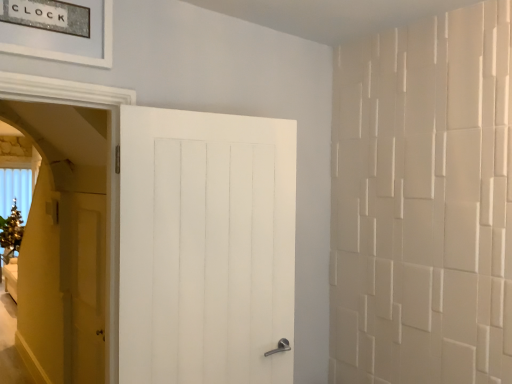
Locate an element on the screen. This screenshot has height=384, width=512. white wooden door at center, the first door viewed from the right is located at coordinates (205, 246).

Describe the element at coordinates (205, 246) in the screenshot. The height and width of the screenshot is (384, 512). I see `white wooden door at center, the 1th door in the front-to-back sequence` at that location.

This screenshot has height=384, width=512. Describe the element at coordinates (84, 285) in the screenshot. I see `matte wood door at left, which is the first door from left to right` at that location.

At what (x,y) coordinates should I click in order to perform the action: click on matte wood door at left, which appears as the 2th door when viewed from the front. Please return your answer as a coordinate pair (x, y). This screenshot has width=512, height=384. Looking at the image, I should click on (84, 285).

Locate an element on the screen. white wooden door at center, the second door viewed from the left is located at coordinates (205, 246).

Which object is positioned more to the left, white wooden door at center, which is counted as the 2th door, starting from the back, or matte wood door at left, placed as the 2th door when sorted from right to left?

Positioned to the left is matte wood door at left, placed as the 2th door when sorted from right to left.

Which is behind, white wooden door at center, the 1th door in the front-to-back sequence, or matte wood door at left, the first door positioned from the back?

matte wood door at left, the first door positioned from the back, is further from the camera.

Does point (283, 367) come closer to viewer compared to point (97, 289)?

That is True.

From the image's perspective, which one is positioned lower, white wooden door at center, the 1th door in the front-to-back sequence, or matte wood door at left, which is the first door from left to right?

From the image's view, matte wood door at left, which is the first door from left to right, is below.

From a real-world perspective, between white wooden door at center, the 1th door in the front-to-back sequence, and matte wood door at left, placed as the 2th door when sorted from right to left, who is vertically lower?

matte wood door at left, placed as the 2th door when sorted from right to left, is physically lower.

Is white wooden door at center, the 1th door in the front-to-back sequence, thinner than matte wood door at left, the first door positioned from the back?

In fact, white wooden door at center, the 1th door in the front-to-back sequence, might be wider than matte wood door at left, the first door positioned from the back.

Can you confirm if white wooden door at center, the 1th door in the front-to-back sequence, is taller than matte wood door at left, which appears as the 2th door when viewed from the front?

Indeed, white wooden door at center, the 1th door in the front-to-back sequence, has a greater height compared to matte wood door at left, which appears as the 2th door when viewed from the front.

Is white wooden door at center, the first door viewed from the right, bigger or smaller than matte wood door at left, which is the first door from left to right?

Clearly, white wooden door at center, the first door viewed from the right, is larger in size than matte wood door at left, which is the first door from left to right.

Is matte wood door at left, placed as the 2th door when sorted from right to left, a part of white wooden door at center, the second door viewed from the left?

Definitely not — matte wood door at left, placed as the 2th door when sorted from right to left, is not inside white wooden door at center, the second door viewed from the left.

Is white wooden door at center, the 1th door in the front-to-back sequence, far from matte wood door at left, which is the first door from left to right?

white wooden door at center, the 1th door in the front-to-back sequence, is actually quite close to matte wood door at left, which is the first door from left to right.

Is white wooden door at center, the second door viewed from the left, positioned with its back to matte wood door at left, which appears as the 2th door when viewed from the front?

Yes.

You are a GUI agent. You are given a task and a screenshot of the screen. Output one action in this format:
    pyautogui.click(x=<x>, y=<y>)
    Task: Click on the door above the matte wood door at left, the first door positioned from the back (from a real-world perspective)
    This screenshot has height=384, width=512.
    Given the screenshot: What is the action you would take?
    pyautogui.click(x=205, y=246)

Between matte wood door at left, placed as the 2th door when sorted from right to left, and white wooden door at center, the second door viewed from the left, which one appears on the right side from the viewer's perspective?

white wooden door at center, the second door viewed from the left.

Between matte wood door at left, which appears as the 2th door when viewed from the front, and white wooden door at center, which is counted as the 2th door, starting from the back, which one is positioned behind?

matte wood door at left, which appears as the 2th door when viewed from the front.

Which is in front, point (87, 232) or point (184, 205)?

The point (184, 205) is closer.

From the image's perspective, is matte wood door at left, the first door positioned from the back, above or below white wooden door at center, the second door viewed from the left?

From the image's perspective, matte wood door at left, the first door positioned from the back, appears below white wooden door at center, the second door viewed from the left.

From a real-world perspective, does matte wood door at left, the first door positioned from the back, sit lower than white wooden door at center, the second door viewed from the left?

Correct, in the physical world, matte wood door at left, the first door positioned from the back, is lower than white wooden door at center, the second door viewed from the left.

Which object is wider, matte wood door at left, which is the first door from left to right, or white wooden door at center, the second door viewed from the left?

white wooden door at center, the second door viewed from the left, is wider.

Does matte wood door at left, which is the first door from left to right, have a lesser height compared to white wooden door at center, the first door viewed from the right?

Yes, matte wood door at left, which is the first door from left to right, is shorter than white wooden door at center, the first door viewed from the right.

In terms of size, does matte wood door at left, which appears as the 2th door when viewed from the front, appear bigger or smaller than white wooden door at center, which is counted as the 2th door, starting from the back?

matte wood door at left, which appears as the 2th door when viewed from the front, is smaller than white wooden door at center, which is counted as the 2th door, starting from the back.

Is white wooden door at center, the second door viewed from the left, completely or partially inside matte wood door at left, placed as the 2th door when sorted from right to left?

Actually, white wooden door at center, the second door viewed from the left, is outside matte wood door at left, placed as the 2th door when sorted from right to left.

Is matte wood door at left, which appears as the 2th door when viewed from the front, in contact with white wooden door at center, which is counted as the 2th door, starting from the back?

No, matte wood door at left, which appears as the 2th door when viewed from the front, is not next to white wooden door at center, which is counted as the 2th door, starting from the back.

Is matte wood door at left, which appears as the 2th door when viewed from the front, aimed at white wooden door at center, the second door viewed from the left?

No, matte wood door at left, which appears as the 2th door when viewed from the front, is not oriented towards white wooden door at center, the second door viewed from the left.

Where is `door that appears on the right of matte wood door at left, the first door positioned from the back`? door that appears on the right of matte wood door at left, the first door positioned from the back is located at coordinates (205, 246).

Image resolution: width=512 pixels, height=384 pixels. I want to click on door behind the white wooden door at center, which is counted as the 2th door, starting from the back, so click(84, 285).

Find the location of a particular element. Image resolution: width=512 pixels, height=384 pixels. door on the left of white wooden door at center, the 1th door in the front-to-back sequence is located at coordinates (84, 285).